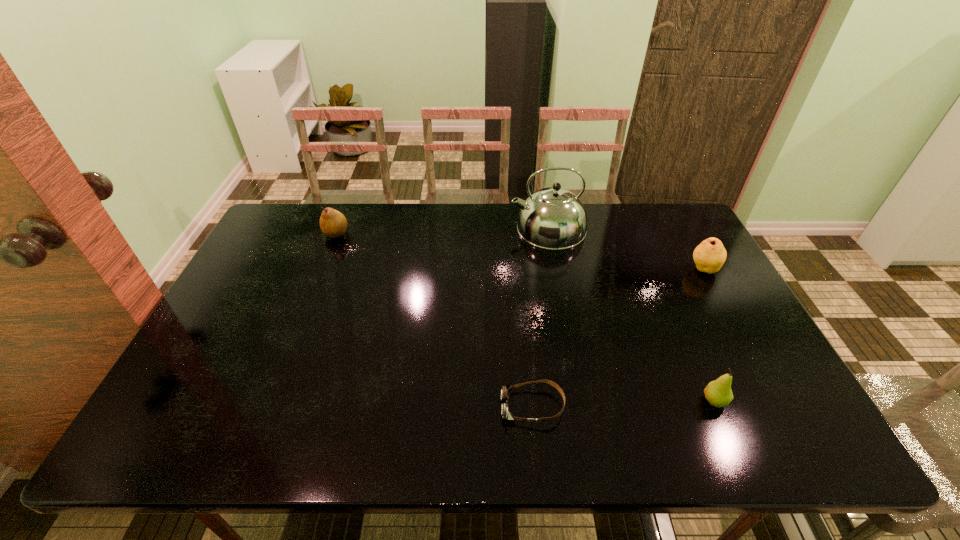
You are a GUI agent. You are given a task and a screenshot of the screen. Output one action in this format:
    pyautogui.click(x=<x>, y=<y>)
    Task: Click on the kettle
    This screenshot has width=960, height=540.
    Given the screenshot: What is the action you would take?
    pyautogui.click(x=553, y=218)

The height and width of the screenshot is (540, 960). I want to click on the farthest pear, so click(x=333, y=224).

Where is `the leftmost pear`? The width and height of the screenshot is (960, 540). the leftmost pear is located at coordinates (333, 224).

The image size is (960, 540). I want to click on the rightmost pear, so click(709, 256).

The height and width of the screenshot is (540, 960). I want to click on the second nearest pear, so click(x=709, y=256).

Locate an element on the screen. Image resolution: width=960 pixels, height=540 pixels. the nearest pear is located at coordinates (718, 393).

Find the location of `the second object from right to left`. the second object from right to left is located at coordinates (718, 393).

Locate an element on the screen. the shortest object is located at coordinates (506, 390).

The height and width of the screenshot is (540, 960). In order to click on vacant space situated 0.360m from the spout of the kettle in this screenshot , I will do coord(405,228).

Where is `vacant space positioned from the spout of the kettle`? vacant space positioned from the spout of the kettle is located at coordinates (399, 228).